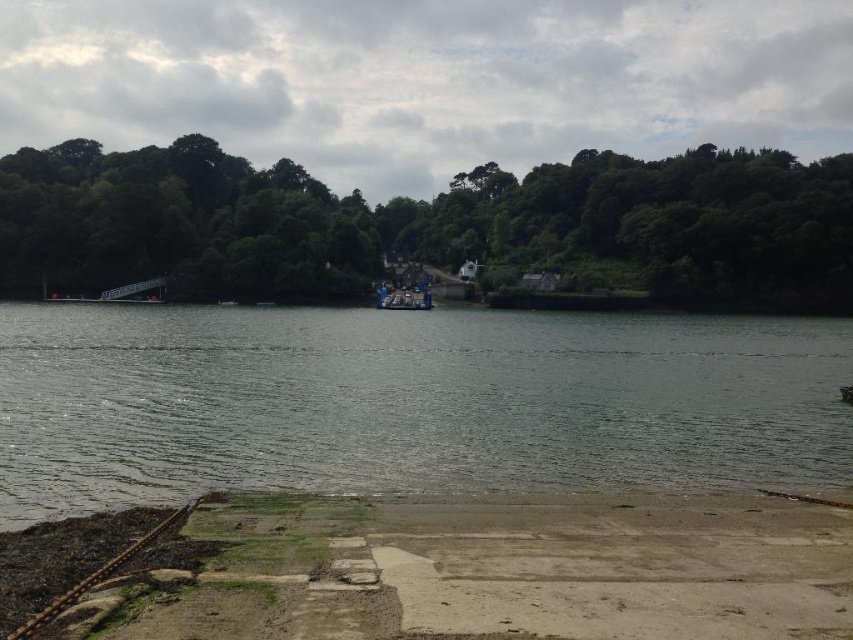
You are standing at the point marked by the coordinates point (436, 570). What type of surface are you currently standing on?

You are standing on concrete at lower center, as the point (436, 570) represents the concrete at lower center.

You are standing at the riverside scene described. You need to place a small wooden bench exactly at the point where the concrete at lower center is located. What are the coordinates of the point where you should place the bench?

The coordinates for placing the bench at the concrete at lower center are point (436,570).